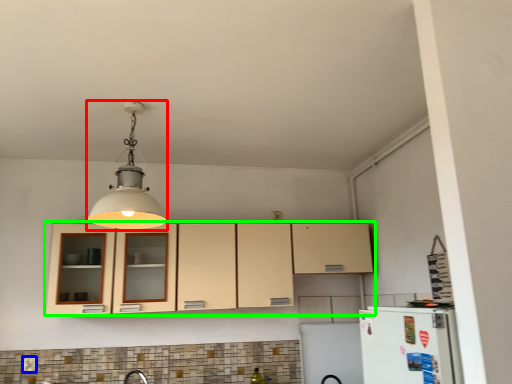
Question: Which is farther away from light fixture (highlighted by a red box)? electric outlet (highlighted by a blue box) or cabinetry (highlighted by a green box)?

Choices:
 (A) electric outlet
 (B) cabinetry

Answer: (A)